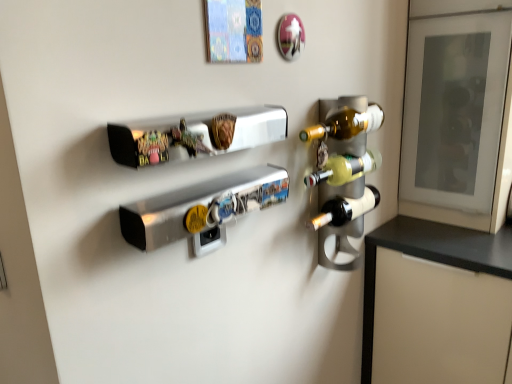
What do you see at coordinates (202, 208) in the screenshot? Image resolution: width=512 pixels, height=384 pixels. I see `brushed metal snowboard at center` at bounding box center [202, 208].

Identify the location of transparent glass door at upper right. The height and width of the screenshot is (384, 512). (458, 116).

What do you see at coordinates (458, 116) in the screenshot?
I see `transparent glass door at upper right` at bounding box center [458, 116].

What do you see at coordinates (346, 209) in the screenshot? I see `matte black wine bottle at right, marked as the 2th bottle in a top-to-bottom arrangement` at bounding box center [346, 209].

What is the approximate width of matte black wine bottle at right, marked as the 2th bottle in a top-to-bottom arrangement?

4.22 inches.

What do you see at coordinates (345, 124) in the screenshot? The image size is (512, 384). I see `translucent glass wine bottle at right, positioned as the 1th bottle in top-to-bottom order` at bounding box center [345, 124].

Find the location of `metallic silver shelf at upper center`. metallic silver shelf at upper center is located at coordinates (195, 135).

In order to click on brushed metal snowboard at center in this screenshot , I will do `click(202, 208)`.

From a real-world perspective, does translucent glass wine bottle at right, the second bottle ordered from the bottom, sit lower than metallic silver shelf at upper center?

Indeed, from a real-world perspective, translucent glass wine bottle at right, the second bottle ordered from the bottom, is positioned beneath metallic silver shelf at upper center.

Find the location of a particular element. Image resolution: width=512 pixels, height=384 pixels. shelf that appears on the left of translucent glass wine bottle at right, the second bottle ordered from the bottom is located at coordinates (195, 135).

Is translucent glass wine bottle at right, the second bottle ordered from the bottom, with metallic silver shelf at upper center?

No, translucent glass wine bottle at right, the second bottle ordered from the bottom, is not in contact with metallic silver shelf at upper center.

From the picture: Visually, is translucent glass wine bottle at right, positioned as the 1th bottle in top-to-bottom order, positioned to the left or to the right of metallic silver shelf at upper center?

Clearly, translucent glass wine bottle at right, positioned as the 1th bottle in top-to-bottom order, is on the right of metallic silver shelf at upper center in the image.

From the image's perspective, relative to brushed metal snowboard at center, is transparent glass door at upper right above or below?

transparent glass door at upper right is above brushed metal snowboard at center.

How different are the orientations of transparent glass door at upper right and brushed metal snowboard at center in degrees?

The angular difference between transparent glass door at upper right and brushed metal snowboard at center is 91 degrees.

Looking at this image, is transparent glass door at upper right inside the boundaries of brushed metal snowboard at center, or outside?

transparent glass door at upper right is not enclosed by brushed metal snowboard at center.

Is transparent glass door at upper right oriented away from brushed metal snowboard at center?

transparent glass door at upper right does not have its back to brushed metal snowboard at center.

Does transparent glass door at upper right have a lesser height compared to matte black wine bottle at right, placed as the 1th bottle when sorted from bottom to top?

No, transparent glass door at upper right is not shorter than matte black wine bottle at right, placed as the 1th bottle when sorted from bottom to top.

Where is `glass door above the matte black wine bottle at right, placed as the 1th bottle when sorted from bottom to top (from the image's perspective)`? The width and height of the screenshot is (512, 384). glass door above the matte black wine bottle at right, placed as the 1th bottle when sorted from bottom to top (from the image's perspective) is located at coordinates (458, 116).

Which object is positioned more to the right, transparent glass door at upper right or matte black wine bottle at right, placed as the 1th bottle when sorted from bottom to top?

From the viewer's perspective, transparent glass door at upper right appears more on the right side.

Which is in front, transparent glass door at upper right or matte black wine bottle at right, placed as the 1th bottle when sorted from bottom to top?

matte black wine bottle at right, placed as the 1th bottle when sorted from bottom to top.

How distant is translucent glass wine bottle at right, positioned as the 1th bottle in top-to-bottom order, from transparent glass door at upper right?

17.52 inches.

Does translucent glass wine bottle at right, positioned as the 1th bottle in top-to-bottom order, lie behind transparent glass door at upper right?

No, translucent glass wine bottle at right, positioned as the 1th bottle in top-to-bottom order, is closer to the viewer.

Can you confirm if translucent glass wine bottle at right, the second bottle ordered from the bottom, is wider than transparent glass door at upper right?

No.

Which is in front, point (350, 122) or point (508, 151)?

Positioned in front is point (350, 122).

Which point is more distant from viewer, (186, 133) or (451, 202)?

Point (451, 202)

Locate an element on the screen. The height and width of the screenshot is (384, 512). glass door above the metallic silver shelf at upper center (from the image's perspective) is located at coordinates click(458, 116).

Is metallic silver shelf at upper center shorter than transparent glass door at upper right?

Indeed, metallic silver shelf at upper center has a lesser height compared to transparent glass door at upper right.

Between metallic silver shelf at upper center and transparent glass door at upper right, which one has smaller width?

Thinner between the two is metallic silver shelf at upper center.

Does transparent glass door at upper right contain translucent glass wine bottle at right, positioned as the 1th bottle in top-to-bottom order?

Actually, translucent glass wine bottle at right, positioned as the 1th bottle in top-to-bottom order, is outside transparent glass door at upper right.

Identify the location of glass door above the translucent glass wine bottle at right, positioned as the 1th bottle in top-to-bottom order (from the image's perspective). This screenshot has height=384, width=512. (458, 116).

From the image's perspective, relative to translucent glass wine bottle at right, positioned as the 1th bottle in top-to-bottom order, is transparent glass door at upper right above or below?

transparent glass door at upper right is above translucent glass wine bottle at right, positioned as the 1th bottle in top-to-bottom order.

Is brushed metal snowboard at center a part of metallic silver shelf at upper center?

Definitely not — brushed metal snowboard at center is not inside metallic silver shelf at upper center.

Is metallic silver shelf at upper center wider than brushed metal snowboard at center?

No.

Is metallic silver shelf at upper center next to brushed metal snowboard at center and touching it?

No, metallic silver shelf at upper center is not with brushed metal snowboard at center.

From the image's perspective, would you say metallic silver shelf at upper center is shown under brushed metal snowboard at center?

Incorrect, from the image's perspective, metallic silver shelf at upper center is higher than brushed metal snowboard at center.

The width and height of the screenshot is (512, 384). I want to click on shelf in front of the translucent glass wine bottle at right, positioned as the 1th bottle in top-to-bottom order, so click(x=195, y=135).

The height and width of the screenshot is (384, 512). Identify the location of glass door located above the brushed metal snowboard at center (from the image's perspective). (458, 116).

Looking at the image, which one is located further to metallic silver shelf at upper center, translucent glass wine bottle at right, positioned as the 1th bottle in top-to-bottom order, or matte black wine bottle at right, placed as the 1th bottle when sorted from bottom to top?

Based on the image, matte black wine bottle at right, placed as the 1th bottle when sorted from bottom to top, appears to be further to metallic silver shelf at upper center.

From the image, which object appears to be farther from brushed metal snowboard at center, matte black wine bottle at right, placed as the 1th bottle when sorted from bottom to top, or metallic silver shelf at upper center?

The object further to brushed metal snowboard at center is matte black wine bottle at right, placed as the 1th bottle when sorted from bottom to top.

Considering their positions, is transparent glass door at upper right positioned further to matte black wine bottle at right, marked as the 2th bottle in a top-to-bottom arrangement, than brushed metal snowboard at center?

transparent glass door at upper right.

From the image, which object appears to be farther from transparent glass door at upper right, translucent glass wine bottle at right, the second bottle ordered from the bottom, or metallic silver shelf at upper center?

Based on the image, metallic silver shelf at upper center appears to be further to transparent glass door at upper right.

Based on their spatial positions, is metallic silver shelf at upper center or transparent glass door at upper right closer to translucent glass wine bottle at right, the second bottle ordered from the bottom?

Based on the image, metallic silver shelf at upper center appears to be nearer to translucent glass wine bottle at right, the second bottle ordered from the bottom.

Consider the image. Which object lies further to the anchor point brushed metal snowboard at center, transparent glass door at upper right or translucent glass wine bottle at right, the second bottle ordered from the bottom?

The object further to brushed metal snowboard at center is transparent glass door at upper right.

Looking at the image, which one is located closer to matte black wine bottle at right, marked as the 2th bottle in a top-to-bottom arrangement, metallic silver shelf at upper center or transparent glass door at upper right?

metallic silver shelf at upper center is positioned closer to the anchor matte black wine bottle at right, marked as the 2th bottle in a top-to-bottom arrangement.

Considering their positions, is transparent glass door at upper right positioned further to translucent glass wine bottle at right, positioned as the 1th bottle in top-to-bottom order, than matte black wine bottle at right, marked as the 2th bottle in a top-to-bottom arrangement?

The object further to translucent glass wine bottle at right, positioned as the 1th bottle in top-to-bottom order, is transparent glass door at upper right.

Identify the location of appliance located between metallic silver shelf at upper center and transparent glass door at upper right in the left-right direction. (202, 208).

Locate an element on the screen. appliance between metallic silver shelf at upper center and matte black wine bottle at right, placed as the 1th bottle when sorted from bottom to top, in the front-back direction is located at coordinates (202, 208).

Find the location of `appliance between metallic silver shelf at upper center and translucent glass wine bottle at right, positioned as the 1th bottle in top-to-bottom order, along the z-axis`. appliance between metallic silver shelf at upper center and translucent glass wine bottle at right, positioned as the 1th bottle in top-to-bottom order, along the z-axis is located at coordinates (202, 208).

Where is `bottle between metallic silver shelf at upper center and matte black wine bottle at right, placed as the 1th bottle when sorted from bottom to top, from front to back`? This screenshot has width=512, height=384. bottle between metallic silver shelf at upper center and matte black wine bottle at right, placed as the 1th bottle when sorted from bottom to top, from front to back is located at coordinates click(x=345, y=124).